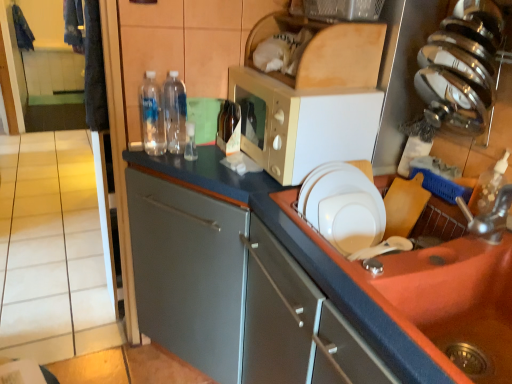
Question: Does brown glass bottle at center, which is the 1th bottle in right-to-left order, have a lesser height compared to satin silver knife block at upper right?

Choices:
 (A) yes
 (B) no

Answer: (A)

Question: Is brown glass bottle at center, which is the 1th bottle in right-to-left order, positioned beyond the bounds of satin silver knife block at upper right?

Choices:
 (A) yes
 (B) no

Answer: (A)

Question: Are brown glass bottle at center, which is the 1th bottle in right-to-left order, and satin silver knife block at upper right located far from each other?

Choices:
 (A) yes
 (B) no

Answer: (B)

Question: Is brown glass bottle at center, which is the 1th bottle in right-to-left order, wider than satin silver knife block at upper right?

Choices:
 (A) yes
 (B) no

Answer: (B)

Question: From a real-world perspective, is brown glass bottle at center, which is the 1th bottle in right-to-left order, beneath satin silver knife block at upper right?

Choices:
 (A) yes
 (B) no

Answer: (A)

Question: Is brown glass bottle at center, which appears as the third bottle when viewed from the left, oriented away from satin silver knife block at upper right?

Choices:
 (A) yes
 (B) no

Answer: (B)

Question: Is transparent plastic bottle at center, the 2th bottle when ordered from left to right, turned away from metallic silver faucet at sink right?

Choices:
 (A) no
 (B) yes

Answer: (A)

Question: Is transparent plastic bottle at center, the 2th bottle viewed from the right, oriented towards metallic silver faucet at sink right?

Choices:
 (A) no
 (B) yes

Answer: (A)

Question: Does transparent plastic bottle at center, the 2th bottle when ordered from left to right, lie in front of metallic silver faucet at sink right?

Choices:
 (A) yes
 (B) no

Answer: (B)

Question: Can you confirm if transparent plastic bottle at center, the 2th bottle when ordered from left to right, is positioned to the right of metallic silver faucet at sink right?

Choices:
 (A) yes
 (B) no

Answer: (B)

Question: Is there a large distance between transparent plastic bottle at center, the 2th bottle when ordered from left to right, and metallic silver faucet at sink right?

Choices:
 (A) no
 (B) yes

Answer: (A)

Question: Does transparent plastic bottle at center, the 2th bottle viewed from the right, have a smaller size compared to metallic silver faucet at sink right?

Choices:
 (A) yes
 (B) no

Answer: (B)

Question: Is beige tile at left completely or partially outside of orange matte sink at lower right?

Choices:
 (A) no
 (B) yes

Answer: (B)